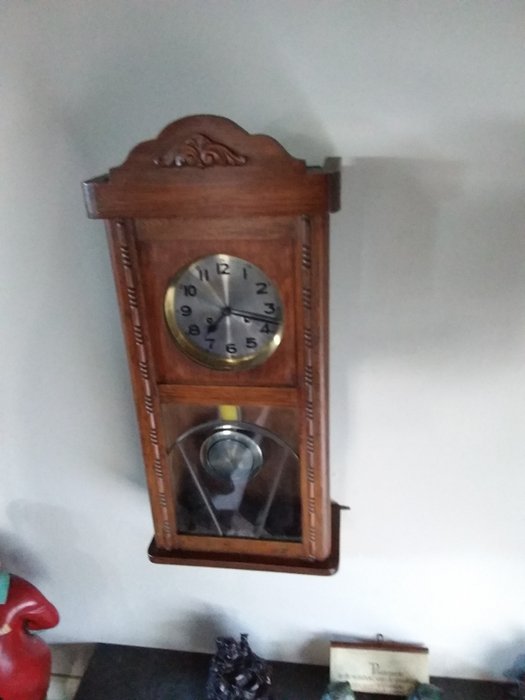
Locate an element on the screen. This screenshot has width=525, height=700. plaque is located at coordinates (377, 673).